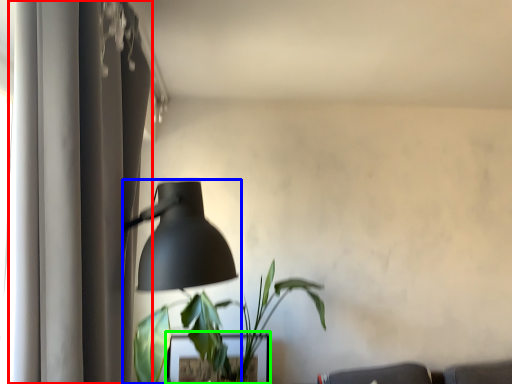
Question: Which is nearer to the curtain (highlighted by a red box)? lamp (highlighted by a blue box) or table (highlighted by a green box).

Choices:
 (A) lamp
 (B) table

Answer: (A)